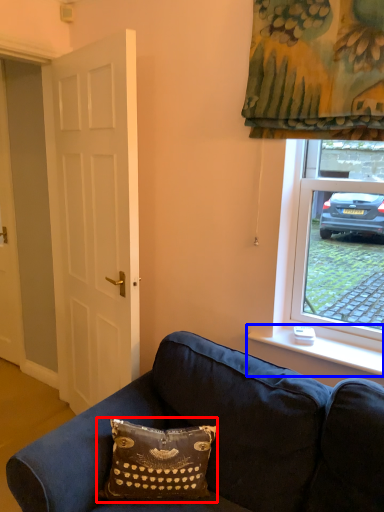
Question: Which object appears farthest to the camera in this image, pillow (highlighted by a red box) or window sill (highlighted by a blue box)?

Choices:
 (A) pillow
 (B) window sill

Answer: (B)